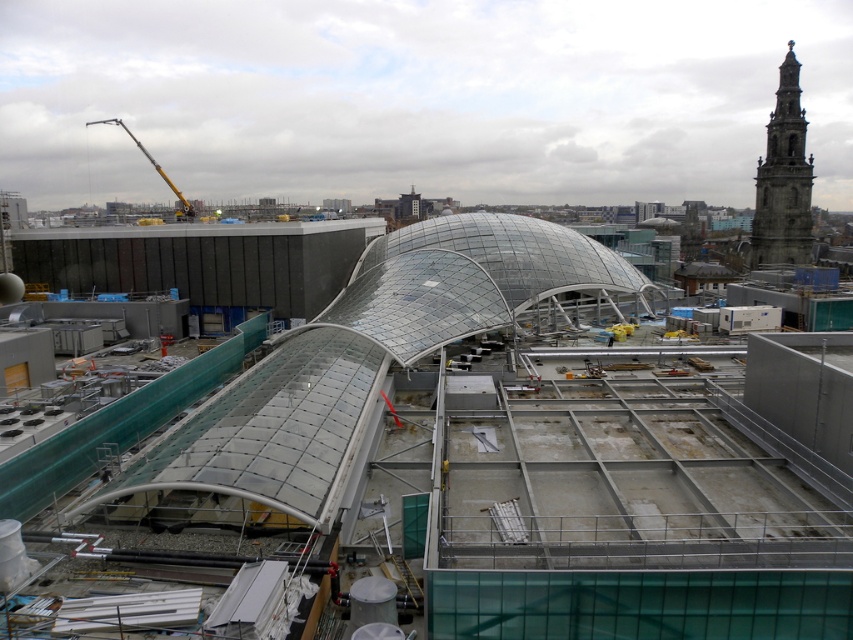
Between transparent glass dome at center and stone tower at upper right, which one is positioned higher?

Positioned higher is stone tower at upper right.

Between transparent glass dome at center and stone tower at upper right, which one appears on the left side from the viewer's perspective?

transparent glass dome at center

Is point (544, 620) more distant than point (757, 243)?

No, (544, 620) is in front of (757, 243).

The height and width of the screenshot is (640, 853). I want to click on transparent glass dome at center, so coord(467,456).